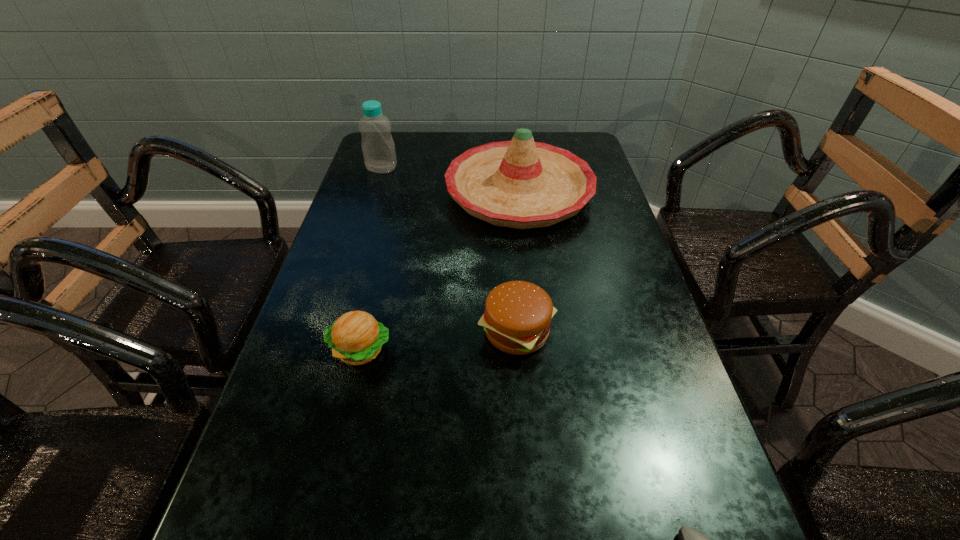
Where is `free space between the left hamburger and the bottle`? This screenshot has height=540, width=960. free space between the left hamburger and the bottle is located at coordinates (x=372, y=259).

Locate an element on the screen. This screenshot has width=960, height=540. unoccupied area between the left hamburger and the right hamburger is located at coordinates (439, 340).

Locate an element on the screen. free space between the left hamburger and the bottle is located at coordinates (372, 259).

Locate an element on the screen. free spot between the right hamburger and the sombrero is located at coordinates (518, 261).

This screenshot has height=540, width=960. Find the location of `free space that is in between the right hamburger and the bottle`. free space that is in between the right hamburger and the bottle is located at coordinates (449, 249).

Find the location of a particular element. This screenshot has width=960, height=540. free space between the sombrero and the left hamburger is located at coordinates (440, 271).

Find the location of a particular element. This screenshot has width=960, height=540. object that stands as the second closest to the bottle is located at coordinates (517, 318).

Locate which object ranks third in proximity to the right hamburger. Please provide its 2D coordinates. Your answer should be formatted as a tuple, i.e. [(x, y)], where the tuple contains the x and y coordinates of a point satisfying the conditions above.

[(690, 539)]

The height and width of the screenshot is (540, 960). What are the coordinates of `hamburger that can be found as the closest to the shortest object` in the screenshot? It's located at (517, 318).

The width and height of the screenshot is (960, 540). I want to click on vacant region that satisfies the following two spatial constraints: 1. on the front side of the bottle; 2. on the right side of the left hamburger, so click(x=325, y=349).